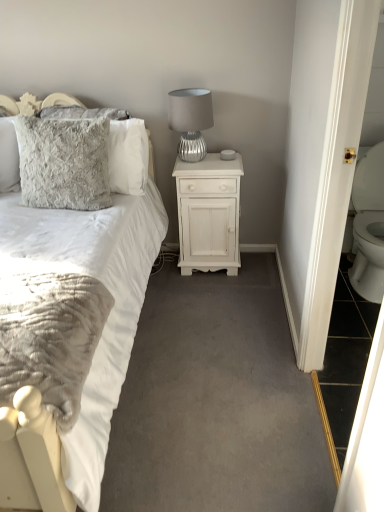
Question: Can you confirm if fluffy gray pillow at upper left, which is counted as the 2th pillow, starting from the front, is positioned to the right of white soft fabric bed at left?

Choices:
 (A) no
 (B) yes

Answer: (B)

Question: Can you see fluffy gray pillow at upper left, positioned as the 1th pillow in back-to-front order, touching white soft fabric bed at left?

Choices:
 (A) no
 (B) yes

Answer: (A)

Question: Is fluffy gray pillow at upper left, positioned as the 1th pillow in back-to-front order, not near white soft fabric bed at left?

Choices:
 (A) no
 (B) yes

Answer: (A)

Question: Is the depth of fluffy gray pillow at upper left, positioned as the 1th pillow in back-to-front order, greater than that of white soft fabric bed at left?

Choices:
 (A) yes
 (B) no

Answer: (A)

Question: Does fluffy gray pillow at upper left, positioned as the 1th pillow in back-to-front order, appear on the left side of white soft fabric bed at left?

Choices:
 (A) yes
 (B) no

Answer: (B)

Question: Considering the positions of point (183, 152) and point (226, 252), is point (183, 152) closer or farther from the camera than point (226, 252)?

Choices:
 (A) farther
 (B) closer

Answer: (B)

Question: Is silver textured lamp at upper right taller or shorter than white painted wood nightstand at center?

Choices:
 (A) tall
 (B) short

Answer: (B)

Question: Considering the positions of silver textured lamp at upper right and white painted wood nightstand at center in the image, is silver textured lamp at upper right bigger or smaller than white painted wood nightstand at center?

Choices:
 (A) small
 (B) big

Answer: (A)

Question: From a real-world perspective, is silver textured lamp at upper right positioned above or below white painted wood nightstand at center?

Choices:
 (A) below
 (B) above

Answer: (B)

Question: In terms of height, does silver textured lamp at upper right look taller or shorter compared to fuzzy gray pillow at upper left, which ranks as the first pillow in front-to-back order?

Choices:
 (A) short
 (B) tall

Answer: (A)

Question: Is point (185, 123) closer or farther from the camera than point (77, 138)?

Choices:
 (A) farther
 (B) closer

Answer: (A)

Question: Considering the positions of silver textured lamp at upper right and fuzzy gray pillow at upper left, which is the 2th pillow from back to front, in the image, is silver textured lamp at upper right bigger or smaller than fuzzy gray pillow at upper left, which is the 2th pillow from back to front,?

Choices:
 (A) small
 (B) big

Answer: (A)

Question: From a real-world perspective, is silver textured lamp at upper right positioned above or below fuzzy gray pillow at upper left, which is the 2th pillow from back to front?

Choices:
 (A) above
 (B) below

Answer: (A)

Question: From the image's perspective, relative to fuzzy gray pillow at upper left, which is the 2th pillow from back to front, is fluffy gray pillow at upper left, which is counted as the 2th pillow, starting from the front, above or below?

Choices:
 (A) above
 (B) below

Answer: (A)

Question: In terms of width, does fluffy gray pillow at upper left, positioned as the 1th pillow in back-to-front order, look wider or thinner when compared to fuzzy gray pillow at upper left, which is the 2th pillow from back to front?

Choices:
 (A) thin
 (B) wide

Answer: (A)